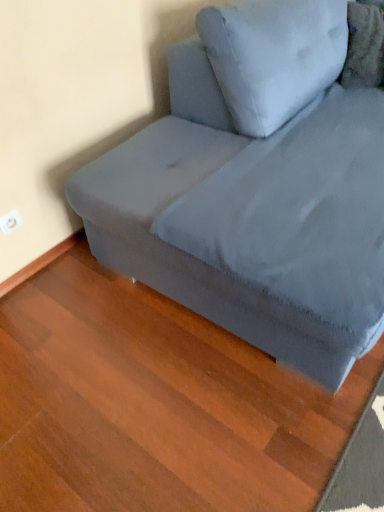
Question: From the image's perspective, relative to velvety gray pillow at upper right, is velvet gray couch at upper right above or below?

Choices:
 (A) below
 (B) above

Answer: (A)

Question: Is velvet gray couch at upper right taller or shorter than velvety gray pillow at upper right?

Choices:
 (A) tall
 (B) short

Answer: (A)

Question: Would you say velvet gray couch at upper right is to the left or to the right of velvety gray pillow at upper right in the picture?

Choices:
 (A) left
 (B) right

Answer: (A)

Question: Is velvety gray pillow at upper right inside the boundaries of velvet gray couch at upper right, or outside?

Choices:
 (A) outside
 (B) inside

Answer: (B)

Question: From a real-world perspective, relative to velvet gray couch at upper right, is velvety gray pillow at upper right vertically above or below?

Choices:
 (A) above
 (B) below

Answer: (A)

Question: Looking at the image, does velvety gray pillow at upper right seem bigger or smaller compared to velvet gray couch at upper right?

Choices:
 (A) small
 (B) big

Answer: (A)

Question: Visually, is velvety gray pillow at upper right positioned to the left or to the right of velvet gray couch at upper right?

Choices:
 (A) left
 (B) right

Answer: (B)